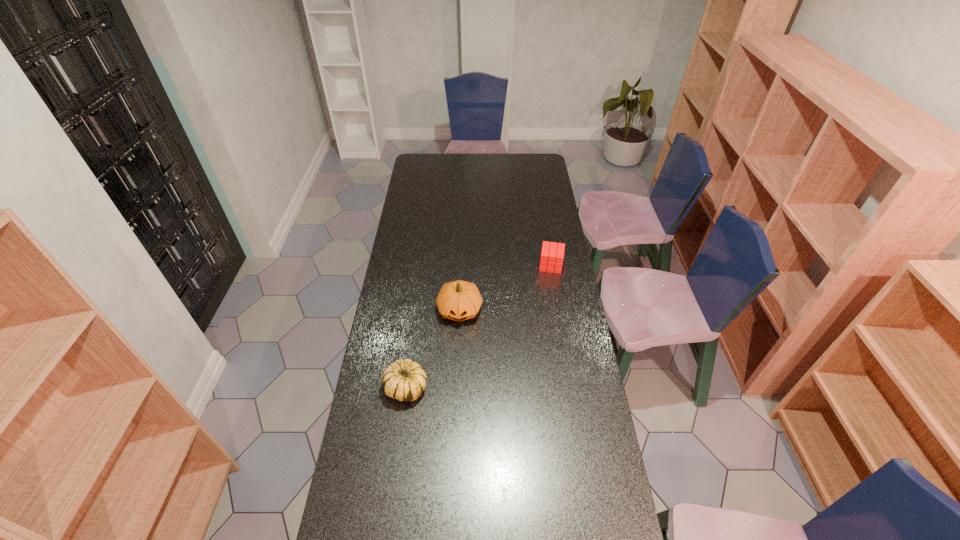
The height and width of the screenshot is (540, 960). What are the coordinates of `object that is at the right edge` in the screenshot? It's located at (554, 256).

Locate an element on the screen. vacant point at the far edge is located at coordinates (450, 167).

Identify the location of blank space at the left edge. This screenshot has height=540, width=960. (414, 240).

Locate an element on the screen. This screenshot has height=540, width=960. free location at the right edge is located at coordinates (592, 395).

This screenshot has height=540, width=960. In order to click on vacant space at the far left corner of the desktop in this screenshot , I will do `click(420, 170)`.

Where is `vacant space at the far right corner of the desktop`? Image resolution: width=960 pixels, height=540 pixels. vacant space at the far right corner of the desktop is located at coordinates pyautogui.click(x=537, y=166).

This screenshot has height=540, width=960. I want to click on free spot between the taller gourd and the nearest object, so click(x=433, y=349).

This screenshot has width=960, height=540. Identify the location of vacant area that lies between the second object from left to right and the shorter gourd. (433, 349).

You are a GUI agent. You are given a task and a screenshot of the screen. Output one action in this format:
    pyautogui.click(x=<x>, y=<y>)
    Task: Click on the free area in between the tallest object and the shorter gourd
    This screenshot has width=960, height=540.
    Given the screenshot: What is the action you would take?
    pyautogui.click(x=433, y=349)

You are a GUI agent. You are given a task and a screenshot of the screen. Output one action in this format:
    pyautogui.click(x=<x>, y=<y>)
    Task: Click on the free spot between the second farthest object and the rightmost object
    The width and height of the screenshot is (960, 540).
    Given the screenshot: What is the action you would take?
    pyautogui.click(x=505, y=288)